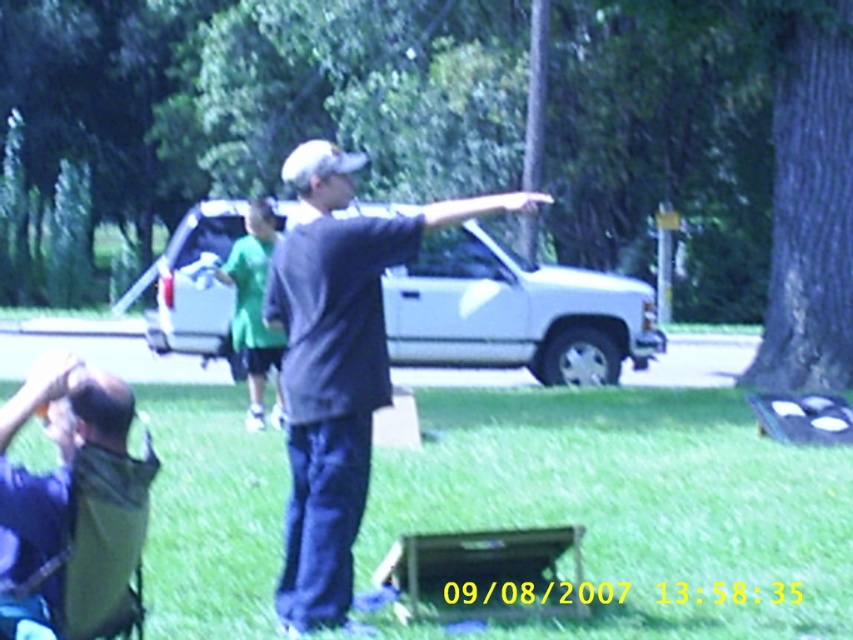
Question: Can you confirm if brown textured tree at center right is smaller than green fabric folding chair at lower left?

Choices:
 (A) yes
 (B) no

Answer: (B)

Question: Estimate the real-world distances between objects in this image. Which object is closer to the green fabric folding chair at lower left?

Choices:
 (A) brown textured tree at center right
 (B) green matte shirt at center
 (C) green grass at lower center

Answer: (C)

Question: Does brown textured tree at center right have a greater width compared to green matte shirt at center?

Choices:
 (A) yes
 (B) no

Answer: (A)

Question: Which of the following is the farthest from the observer?

Choices:
 (A) green matte shirt at center
 (B) dark gray shirt at center
 (C) brown textured tree at center right
 (D) green grass at lower center

Answer: (C)

Question: Does brown textured tree at center right appear on the right side of dark gray shirt at center?

Choices:
 (A) yes
 (B) no

Answer: (B)

Question: Estimate the real-world distances between objects in this image. Which object is closer to the green grass at lower center?

Choices:
 (A) green matte shirt at center
 (B) green fabric folding chair at lower left

Answer: (A)